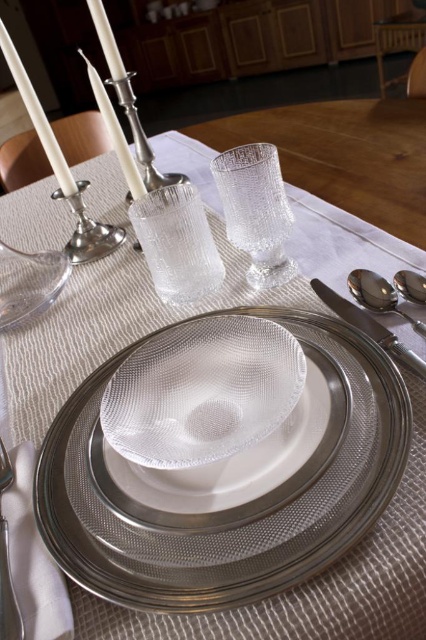
Does satin silver knife at upper right appear over silver metallic candle holder at upper left?

No, satin silver knife at upper right is not above silver metallic candle holder at upper left.

Between satin silver knife at upper right and silver metallic candle holder at upper left, which one is positioned lower?

satin silver knife at upper right is lower down.

Who is more distant from viewer, [357,308] or [97,100]?

Point [97,100]

What are the coordinates of `satin silver knife at upper right` in the screenshot? It's located at (370, 326).

Does point (267, 211) come behind point (363, 330)?

Yes, point (267, 211) is behind point (363, 330).

Does point (261, 269) lie in front of point (386, 346)?

No.

This screenshot has height=640, width=426. I want to click on clear textured glass at center, so click(256, 211).

Is point (397, 305) positioned behind point (403, 276)?

No.

Which is more to the left, satin silver spoon at lower right or satin silver spoon at upper right?

satin silver spoon at lower right is more to the left.

The width and height of the screenshot is (426, 640). I want to click on satin silver spoon at lower right, so click(379, 296).

Locate an element on the screen. satin silver spoon at lower right is located at coordinates (379, 296).